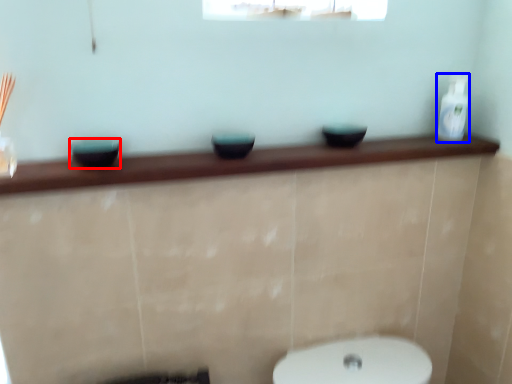
Question: Among these objects, which one is nearest to the camera, basin (highlighted by a red box) or toiletry (highlighted by a blue box)?

Choices:
 (A) basin
 (B) toiletry

Answer: (A)